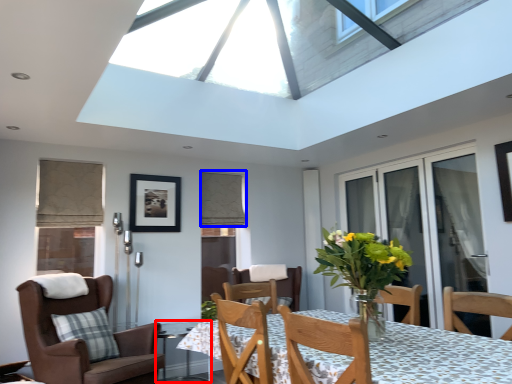
Question: Which point is closer to the camera, glass table (highlighted by a red box) or curtain (highlighted by a blue box)?

Choices:
 (A) glass table
 (B) curtain

Answer: (A)